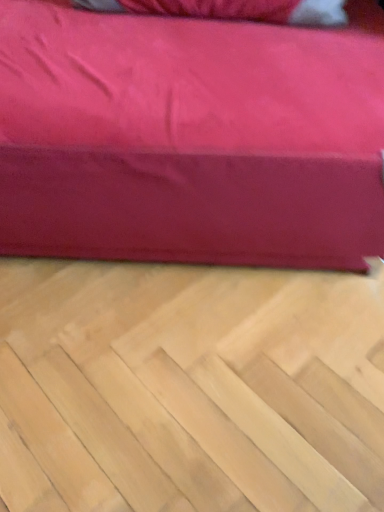
Find the location of a particular element. Image resolution: width=384 pixels, height=512 pixels. velvet-like red couch at upper center is located at coordinates (189, 139).

The width and height of the screenshot is (384, 512). Describe the element at coordinates (189, 139) in the screenshot. I see `velvet-like red couch at upper center` at that location.

Where is `velvet-like red couch at upper center`? velvet-like red couch at upper center is located at coordinates (189, 139).